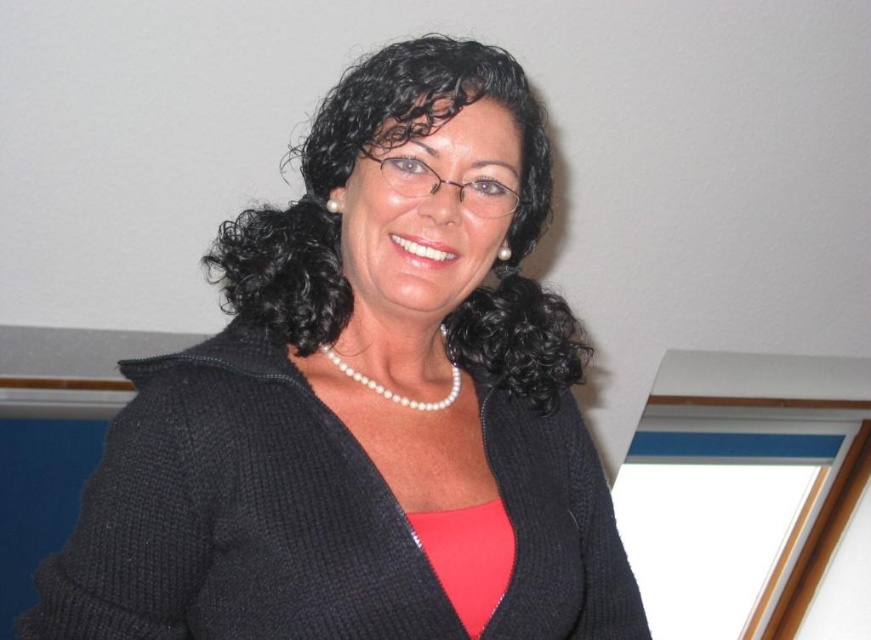
You are an interior designer asked to place a small decorative item on the wall at the location marked by point (365, 403). What object is located at this point?

The point (365, 403) marks the location of the black knitted sweater at center, so the decorative item should be placed there.

You are a fashion designer trying to create a new outfit. You have a black knitted sweater at center and a pearl necklace at center. Which item is taller and should be considered for vertical space in the design?

The black knitted sweater at center is much taller than the pearl necklace at center, so it should be considered for vertical space in the design.